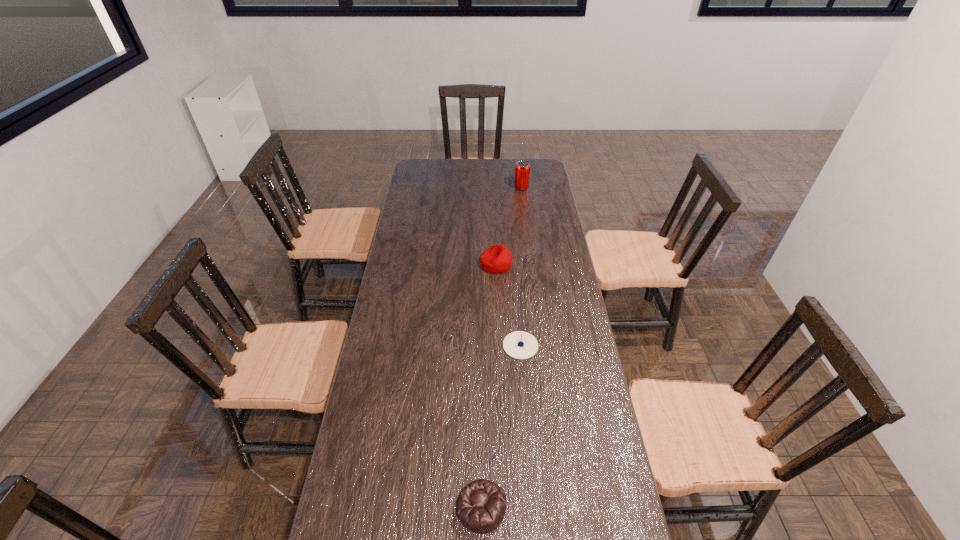
Where is `free area in between the compass and the second tallest object`? The height and width of the screenshot is (540, 960). free area in between the compass and the second tallest object is located at coordinates (509, 305).

Find the location of a particular element. The image size is (960, 540). empty space that is in between the tallest object and the third farthest object is located at coordinates (521, 267).

At what (x,y) coordinates should I click in order to perform the action: click on free spot between the taller beanbag and the nearer beanbag. Please return your answer as a coordinate pair (x, y). This screenshot has height=540, width=960. Looking at the image, I should click on (489, 386).

Locate an element on the screen. vacant area between the compass and the soda can is located at coordinates (521, 267).

Find the location of a particular element. Image resolution: width=960 pixels, height=540 pixels. empty space between the third farthest object and the nearest object is located at coordinates point(501,427).

This screenshot has height=540, width=960. Find the location of `vacant space that is in between the farther beanbag and the tallest object`. vacant space that is in between the farther beanbag and the tallest object is located at coordinates (509, 226).

This screenshot has height=540, width=960. Identify the location of empty space that is in between the third farthest object and the shorter beanbag. (501, 427).

Find the location of a particular element. This screenshot has height=540, width=960. object identified as the closest to the tallest object is located at coordinates (496, 259).

Find the location of `the second closest object relative to the compass`. the second closest object relative to the compass is located at coordinates (481, 505).

This screenshot has width=960, height=540. Identify the location of free location that satisfies the following two spatial constraints: 1. on the front side of the soda can; 2. on the seat area of the taller beanbag. (531, 264).